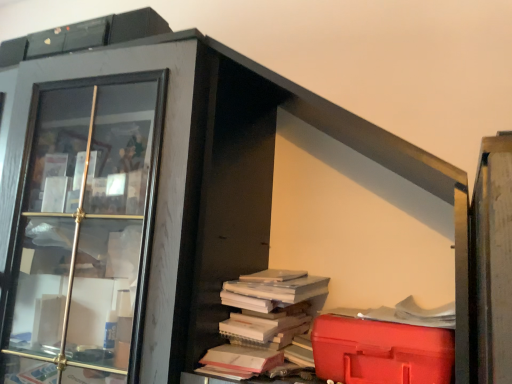
What do you see at coordinates (263, 320) in the screenshot? The image size is (512, 384). I see `white paper book at center` at bounding box center [263, 320].

The height and width of the screenshot is (384, 512). Identify the location of matte glass cabinet at left. (84, 230).

Describe the element at coordinates (381, 352) in the screenshot. The height and width of the screenshot is (384, 512). I see `red plastic toolbox at lower right` at that location.

In order to click on white paper book at center in this screenshot , I will do `click(263, 320)`.

Can you confirm if red plastic toolbox at lower right is taller than matte glass cabinet at left?

In fact, red plastic toolbox at lower right may be shorter than matte glass cabinet at left.

Considering the positions of point (414, 357) and point (97, 379), is point (414, 357) closer or farther from the camera than point (97, 379)?

Point (414, 357) appears to be closer to the viewer than point (97, 379).

Is red plastic toolbox at lower right not within matte glass cabinet at left?

Yes, red plastic toolbox at lower right is not within matte glass cabinet at left.

Can you confirm if matte glass cabinet at left is bigger than red plastic toolbox at lower right?

Yes, matte glass cabinet at left is bigger than red plastic toolbox at lower right.

Which is more to the left, matte glass cabinet at left or red plastic toolbox at lower right?

matte glass cabinet at left is more to the left.

In terms of width, does matte glass cabinet at left look wider or thinner when compared to red plastic toolbox at lower right?

Clearly, matte glass cabinet at left has more width compared to red plastic toolbox at lower right.

Is the position of white paper book at center less distant than that of matte glass cabinet at left?

No, the depth of white paper book at center is greater than that of matte glass cabinet at left.

Is white paper book at center taller or shorter than matte glass cabinet at left?

In the image, white paper book at center appears to be shorter than matte glass cabinet at left.

Is white paper book at center smaller than matte glass cabinet at left?

Indeed, white paper book at center has a smaller size compared to matte glass cabinet at left.

Are white paper book at center and matte glass cabinet at left making contact?

white paper book at center is not next to matte glass cabinet at left, and they're not touching.

From the image's perspective, is red plastic toolbox at lower right over white paper book at center?

Incorrect, from the image's perspective, red plastic toolbox at lower right is lower than white paper book at center.

Is red plastic toolbox at lower right aimed at white paper book at center?

No.

Locate an element on the screen. The width and height of the screenshot is (512, 384). book on the left of red plastic toolbox at lower right is located at coordinates (263, 320).

From a real-world perspective, is red plastic toolbox at lower right beneath white paper book at center?

Yes, from a real-world perspective, red plastic toolbox at lower right is under white paper book at center.

From a real-world perspective, is matte glass cabinet at left over white paper book at center?

Yes.

Is matte glass cabinet at left turned away from white paper book at center?

matte glass cabinet at left is not turned away from white paper book at center.

Is point (119, 254) positioned in front of point (254, 351)?

No, (119, 254) is behind (254, 351).

Which of these two, matte glass cabinet at left or white paper book at center, stands shorter?

white paper book at center is shorter.

Is white paper book at center smaller than red plastic toolbox at lower right?

Actually, white paper book at center might be larger than red plastic toolbox at lower right.

In the image, is white paper book at center positioned in front of or behind red plastic toolbox at lower right?

white paper book at center is positioned farther from the viewer than red plastic toolbox at lower right.

Which object is wider, white paper book at center or red plastic toolbox at lower right?

Wider between the two is white paper book at center.

Considering the positions of objects white paper book at center and red plastic toolbox at lower right in the image provided, who is more to the right, white paper book at center or red plastic toolbox at lower right?

red plastic toolbox at lower right is more to the right.

This screenshot has width=512, height=384. In order to click on waste behind the matte glass cabinet at left in this screenshot , I will do `click(381, 352)`.

The height and width of the screenshot is (384, 512). I want to click on glass door above the red plastic toolbox at lower right (from the image's perspective), so click(84, 230).

Which object lies nearer to the anchor point matte glass cabinet at left, white paper book at center or red plastic toolbox at lower right?

Based on the image, white paper book at center appears to be nearer to matte glass cabinet at left.

Based on their spatial positions, is white paper book at center or matte glass cabinet at left further from red plastic toolbox at lower right?

matte glass cabinet at left.

Estimate the real-world distances between objects in this image. Which object is closer to matte glass cabinet at left, red plastic toolbox at lower right or white paper book at center?

white paper book at center lies closer to matte glass cabinet at left than the other object.

Estimate the real-world distances between objects in this image. Which object is closer to red plastic toolbox at lower right, matte glass cabinet at left or white paper book at center?

white paper book at center.

Which object lies further to the anchor point white paper book at center, matte glass cabinet at left or red plastic toolbox at lower right?

matte glass cabinet at left is further to white paper book at center.

Estimate the real-world distances between objects in this image. Which object is further from white paper book at center, red plastic toolbox at lower right or matte glass cabinet at left?

Based on the image, matte glass cabinet at left appears to be further to white paper book at center.

I want to click on book between matte glass cabinet at left and red plastic toolbox at lower right in the horizontal direction, so click(x=263, y=320).